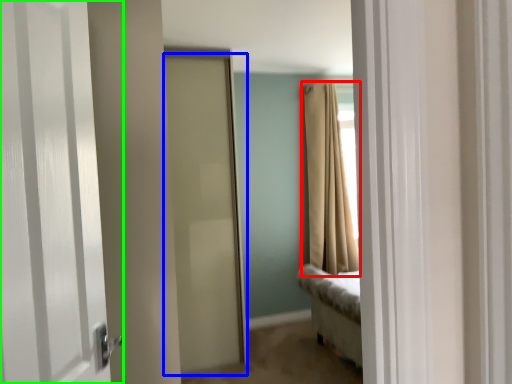
Question: Considering the real-world distances, which object is farthest from curtain (highlighted by a red box)? door (highlighted by a blue box) or door (highlighted by a green box)?

Choices:
 (A) door
 (B) door

Answer: (B)